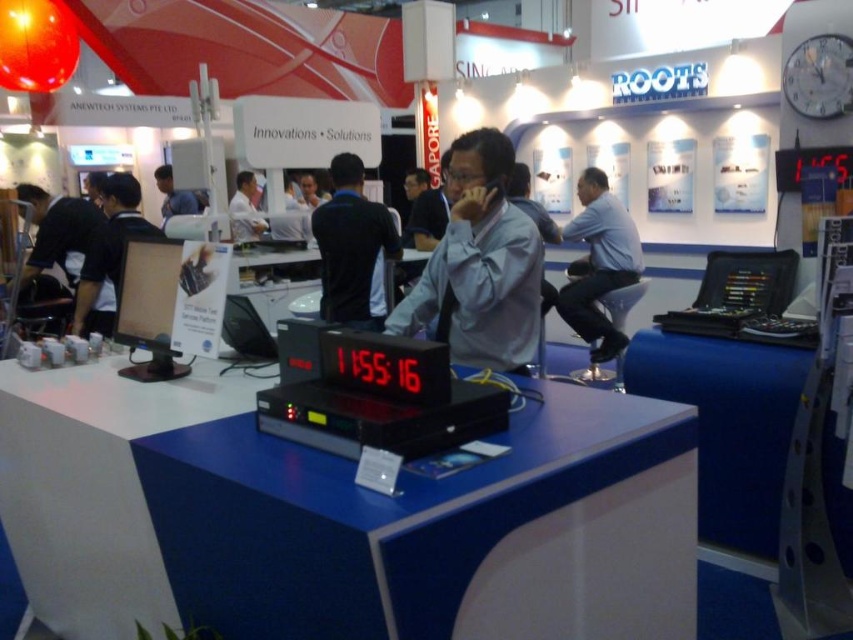
Question: Which is farther from the gray matte shirt at center?

Choices:
 (A) light blue shirt at center
 (B) black fabric shirt at center
 (C) white plastic clock at upper right

Answer: (A)

Question: Is light blue shirt at center bigger than white plastic clock at upper right?

Choices:
 (A) no
 (B) yes

Answer: (B)

Question: Does black fabric shirt at center appear on the left side of white plastic clock at upper right?

Choices:
 (A) no
 (B) yes

Answer: (B)

Question: Among these objects, which one is nearest to the camera?

Choices:
 (A) gray matte shirt at center
 (B) black fabric shirt at center
 (C) white plastic clock at upper right
 (D) light blue shirt at center

Answer: (A)

Question: Estimate the real-world distances between objects in this image. Which object is farther from the gray matte shirt at center?

Choices:
 (A) light blue shirt at center
 (B) white plastic clock at upper right
 (C) black fabric shirt at center

Answer: (A)

Question: Does gray matte shirt at center come behind white plastic clock at upper right?

Choices:
 (A) no
 (B) yes

Answer: (A)